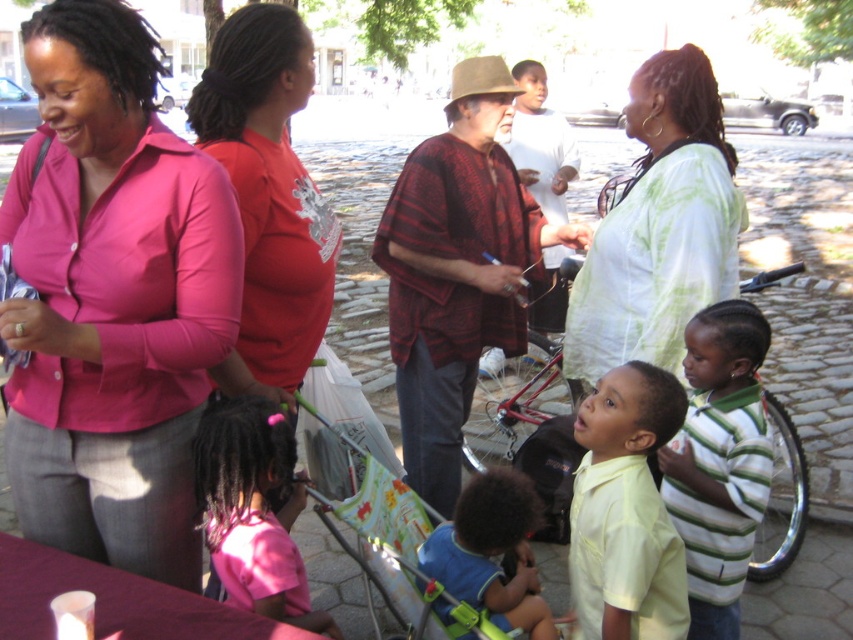
Which is more to the right, yellow smooth shirt at center or pink fabric shirt at lower left?

yellow smooth shirt at center

This screenshot has height=640, width=853. Describe the element at coordinates (625, 512) in the screenshot. I see `yellow smooth shirt at center` at that location.

This screenshot has height=640, width=853. Find the location of `yellow smooth shirt at center`. yellow smooth shirt at center is located at coordinates (625, 512).

Between reddish-brown woven poncho at center and light green tie-dye blouse at center, which one has less height?

light green tie-dye blouse at center

Is reddish-brown woven poncho at center thinner than light green tie-dye blouse at center?

Incorrect, reddish-brown woven poncho at center's width is not less than light green tie-dye blouse at center's.

Who is more distant from viewer, (474, 60) or (718, 141)?

Point (474, 60)

Locate an element on the screen. The image size is (853, 640). reddish-brown woven poncho at center is located at coordinates (457, 269).

Consider the image. Does matte red shirt at center appear over yellow smooth shirt at center?

Yes, matte red shirt at center is above yellow smooth shirt at center.

Is matte red shirt at center closer to the viewer compared to yellow smooth shirt at center?

Yes.

Between point (312, 276) and point (573, 586), which one is positioned behind?

The point (573, 586) is behind.

Locate an element on the screen. The image size is (853, 640). matte red shirt at center is located at coordinates (268, 196).